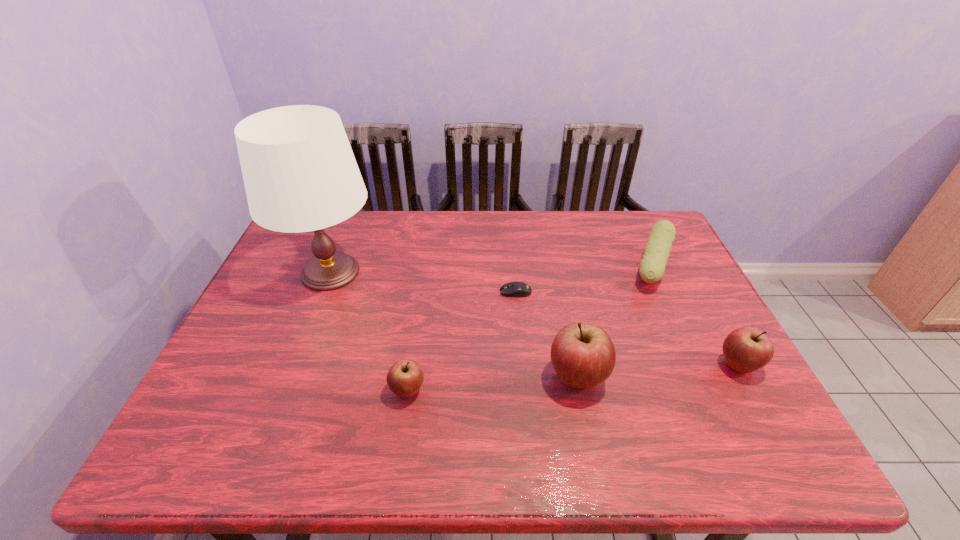
Locate an element on the screen. Image resolution: width=960 pixels, height=540 pixels. object identified as the closest to the tallest object is located at coordinates (405, 377).

I want to click on the closest apple to the shortest apple, so click(x=583, y=355).

Point out which apple is positioned as the nearest to the rightmost apple. Please provide its 2D coordinates. Your answer should be formatted as a tuple, i.e. [(x, y)], where the tuple contains the x and y coordinates of a point satisfying the conditions above.

[(583, 355)]

Find the location of a particular element. The image size is (960, 540). vacant position in the image that satisfies the following two spatial constraints: 1. on the back side of the cucumber; 2. on the right side of the shortest apple is located at coordinates (425, 267).

Where is `free spot that satisfies the following two spatial constraints: 1. on the front side of the second tallest apple; 2. on the left side of the cucumber`? free spot that satisfies the following two spatial constraints: 1. on the front side of the second tallest apple; 2. on the left side of the cucumber is located at coordinates (699, 366).

Find the location of `free spot that satisfies the following two spatial constraints: 1. on the front side of the shortest apple; 2. on the right side of the tallest object`. free spot that satisfies the following two spatial constraints: 1. on the front side of the shortest apple; 2. on the right side of the tallest object is located at coordinates (284, 391).

I want to click on vacant point that satisfies the following two spatial constraints: 1. on the back side of the tallest apple; 2. on the right side of the cucumber, so click(x=555, y=267).

You are a GUI agent. You are given a task and a screenshot of the screen. Output one action in this format:
    pyautogui.click(x=<x>, y=<y>)
    Task: Click on the vacant space that satisfies the following two spatial constraints: 1. on the back side of the fourth shortest object; 2. on the wheel side of the shortest object
    Image resolution: width=960 pixels, height=540 pixels.
    Given the screenshot: What is the action you would take?
    pyautogui.click(x=698, y=292)